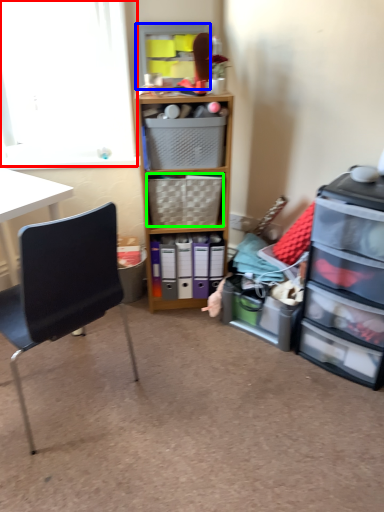
Question: Considering the real-world distances, which object is closest to window screen (highlighted by a red box)? shelf (highlighted by a blue box) or picnic basket (highlighted by a green box).

Choices:
 (A) shelf
 (B) picnic basket

Answer: (A)